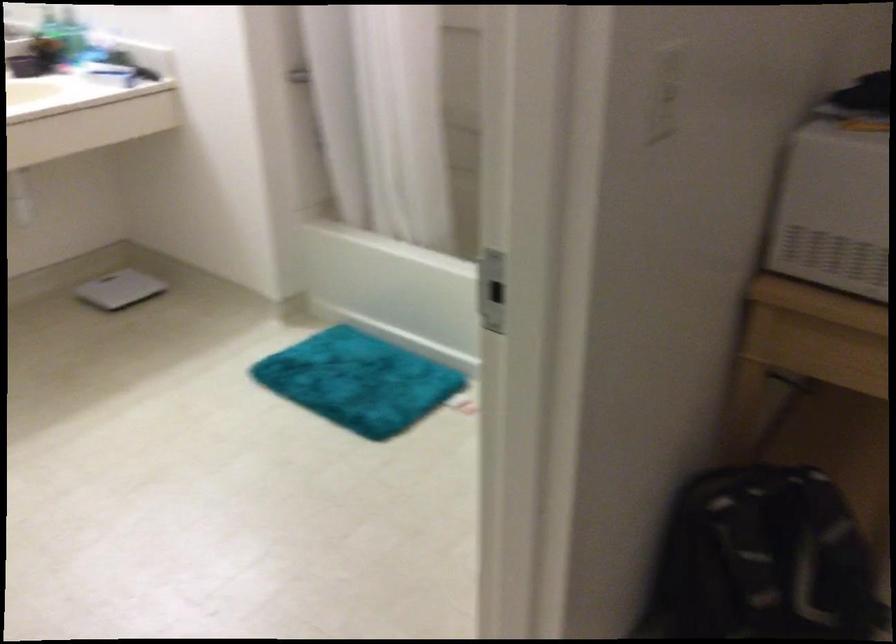
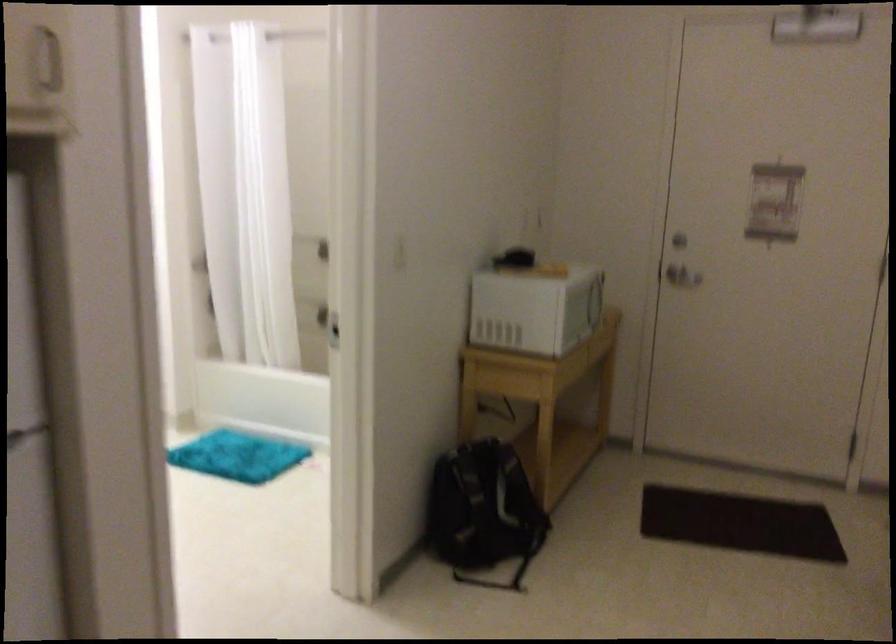
Question: Which direction would the cameraman need to move to produce the second image? Reply with the corresponding letter.

Choices:
 (A) Left
 (B) Right
 (C) Forward
 (D) Backward

Answer: (D)